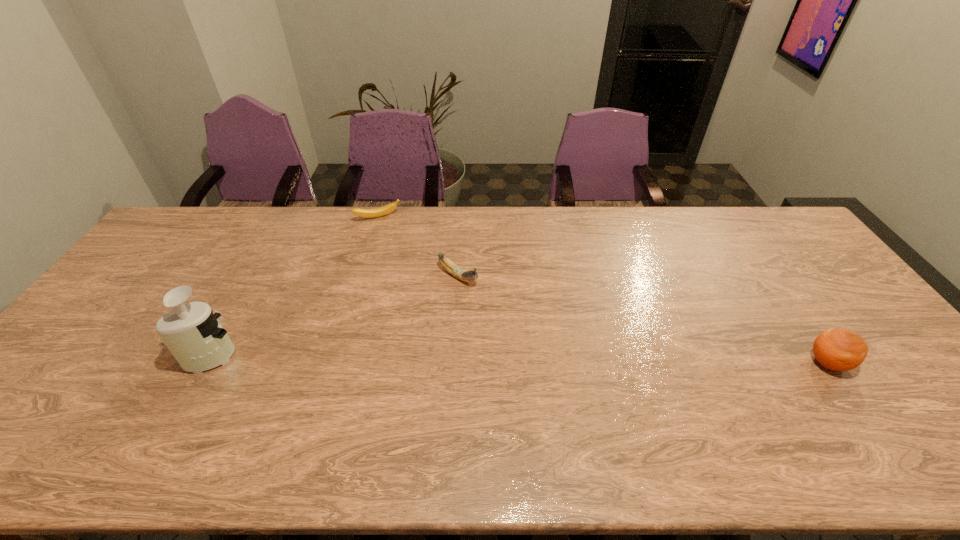
Find the location of a particular element. This screenshot has width=960, height=540. vacant space at the left edge of the desktop is located at coordinates (167, 291).

Find the location of `free space at the far left corner of the desktop`. free space at the far left corner of the desktop is located at coordinates (161, 242).

The image size is (960, 540). In the image, there is a desktop. What are the coordinates of `vacant space at the far right corner` in the screenshot? It's located at (760, 208).

You are a GUI agent. You are given a task and a screenshot of the screen. Output one action in this format:
    pyautogui.click(x=<x>, y=<y>)
    Task: Click on the vacant space in between the tallest object and the nearer banana
    
    Given the screenshot: What is the action you would take?
    pyautogui.click(x=336, y=315)

Find the location of a particular element. This screenshot has height=540, width=960. vacant area that lies between the leftmost object and the third nearest object is located at coordinates (336, 315).

Where is `free point between the shorter banana and the rightmost object`? This screenshot has width=960, height=540. free point between the shorter banana and the rightmost object is located at coordinates (603, 291).

Where is `blank region between the orange and the third nearest object`? This screenshot has width=960, height=540. blank region between the orange and the third nearest object is located at coordinates (643, 320).

Find the location of a particular element. This screenshot has width=960, height=540. unoccupied position between the taller banana and the orange is located at coordinates (643, 320).

Locate an element on the screen. The height and width of the screenshot is (540, 960). free spot between the juicer and the rightmost object is located at coordinates (521, 359).

You are a GUI agent. You are given a task and a screenshot of the screen. Output one action in this format:
    pyautogui.click(x=<x>, y=<y>)
    Task: Click on the empty space between the farther banana and the juicer
    The height and width of the screenshot is (540, 960).
    Given the screenshot: What is the action you would take?
    click(x=296, y=286)